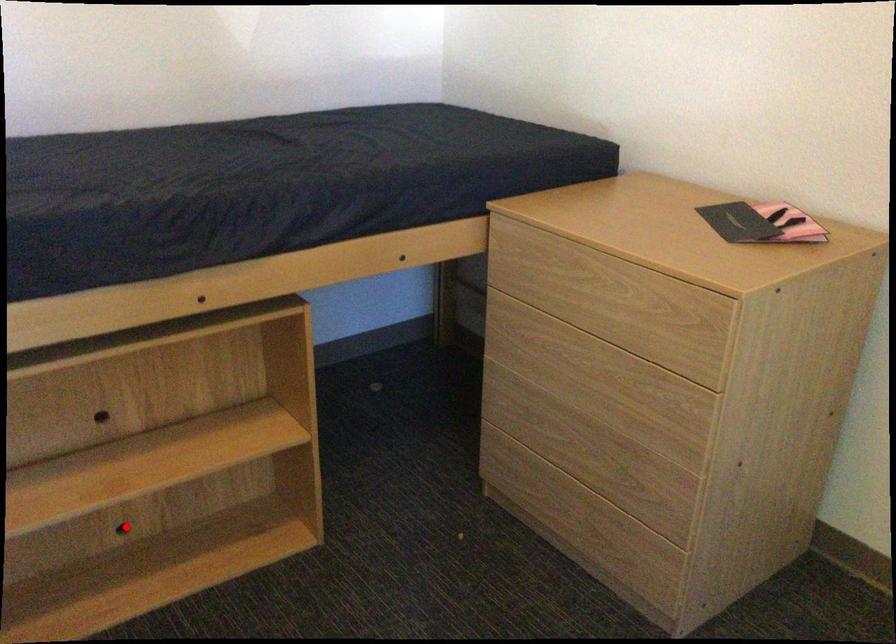
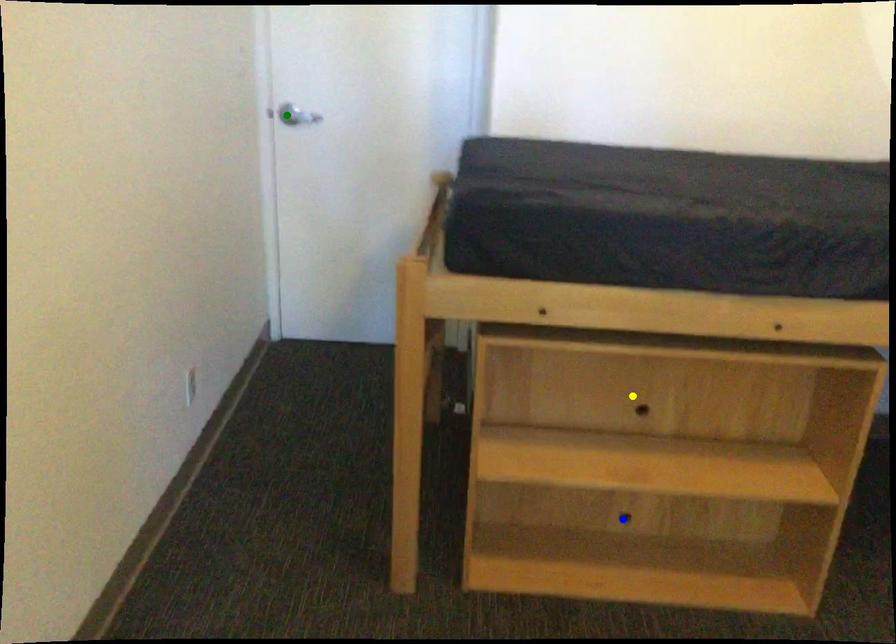
Question: I am providing you with two images of the same scene from different viewpoints. A red point is marked on the first image. You are given multiple points on the second image. In image 2, which mark is for the same physical point as the one in image 1?

Choices:
 (A) blue point
 (B) yellow point
 (C) green point

Answer: (A)